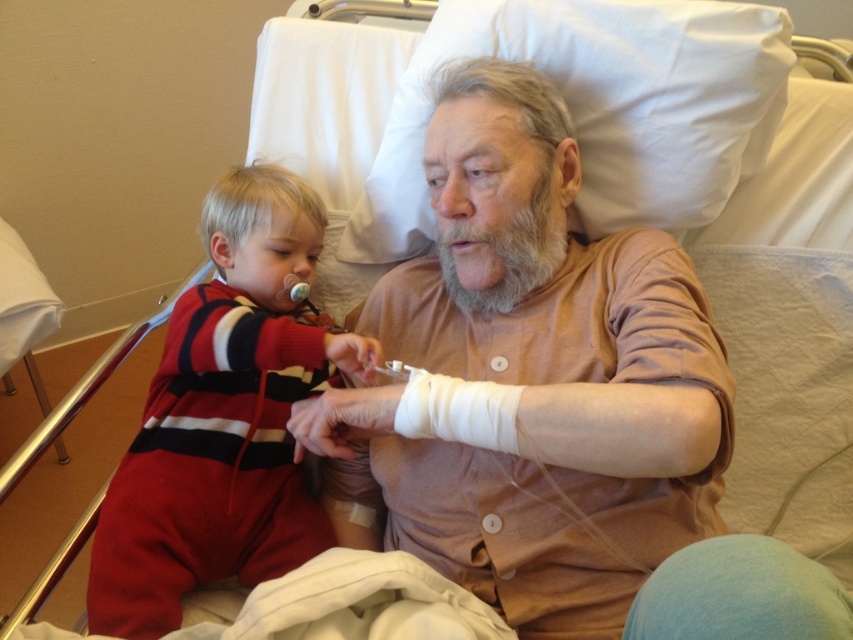
Question: Can you confirm if red striped onesie at left is positioned below gray/soft hair at center?

Choices:
 (A) yes
 (B) no

Answer: (A)

Question: In this image, where is red striped onesie at left located relative to gray/soft hair at center?

Choices:
 (A) above
 (B) below

Answer: (B)

Question: Estimate the real-world distances between objects in this image. Which object is farther from the red striped onesie at left?

Choices:
 (A) gray/soft hair at center
 (B) matte brown shirt at center

Answer: (A)

Question: Is red striped onesie at left further to the viewer compared to gray/soft hair at center?

Choices:
 (A) yes
 (B) no

Answer: (B)

Question: Which point appears closest to the camera in this image?

Choices:
 (A) (171, 556)
 (B) (521, 298)
 (C) (645, 241)

Answer: (A)

Question: Among these objects, which one is farthest from the camera?

Choices:
 (A) matte brown shirt at center
 (B) gray/soft hair at center
 (C) red striped onesie at left

Answer: (B)